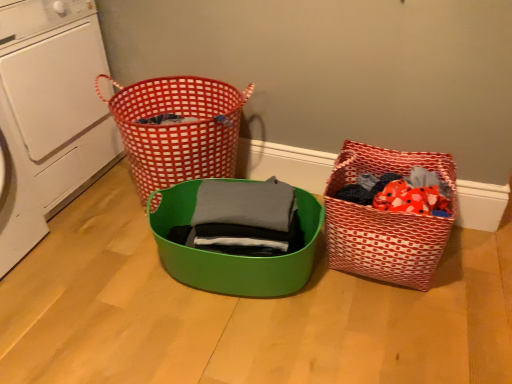
Question: Can you confirm if red checkered basket at upper left is shorter than matte green bowl at center, placed as the first basket when sorted from left to right?

Choices:
 (A) no
 (B) yes

Answer: (A)

Question: From the image's perspective, is red checkered basket at upper left beneath matte green bowl at center, which ranks as the second basket in right-to-left order?

Choices:
 (A) yes
 (B) no

Answer: (B)

Question: Is matte green bowl at center, placed as the first basket when sorted from left to right, at the back of red checkered basket at upper left?

Choices:
 (A) yes
 (B) no

Answer: (B)

Question: Can you confirm if red checkered basket at upper left is positioned to the left of matte green bowl at center, placed as the first basket when sorted from left to right?

Choices:
 (A) yes
 (B) no

Answer: (A)

Question: Is the position of red checkered basket at upper left less distant than that of matte green bowl at center, placed as the first basket when sorted from left to right?

Choices:
 (A) no
 (B) yes

Answer: (A)

Question: Looking at their shapes, would you say red checkered basket at upper left is wider or thinner than red woven fabric basket at lower right, which appears as the first basket when viewed from the right?

Choices:
 (A) thin
 (B) wide

Answer: (B)

Question: Which is correct: red checkered basket at upper left is inside red woven fabric basket at lower right, which appears as the first basket when viewed from the right, or outside of it?

Choices:
 (A) outside
 (B) inside

Answer: (A)

Question: From a real-world perspective, relative to red woven fabric basket at lower right, which is the second basket from left to right, is red checkered basket at upper left vertically above or below?

Choices:
 (A) above
 (B) below

Answer: (A)

Question: Is point (195, 140) positioned closer to the camera than point (353, 160)?

Choices:
 (A) farther
 (B) closer

Answer: (B)

Question: From the image's perspective, is red checkered basket at upper left located above or below white plastic washing machine at left?

Choices:
 (A) below
 (B) above

Answer: (A)

Question: In terms of width, does red checkered basket at upper left look wider or thinner when compared to white plastic washing machine at left?

Choices:
 (A) thin
 (B) wide

Answer: (A)

Question: Considering the positions of point (160, 157) and point (31, 140), is point (160, 157) closer or farther from the camera than point (31, 140)?

Choices:
 (A) closer
 (B) farther

Answer: (A)

Question: Is red checkered basket at upper left bigger or smaller than white plastic washing machine at left?

Choices:
 (A) small
 (B) big

Answer: (A)

Question: From the image's perspective, is white plastic washing machine at left positioned above or below matte green bowl at center, placed as the first basket when sorted from left to right?

Choices:
 (A) below
 (B) above

Answer: (B)

Question: Is white plastic washing machine at left taller or shorter than matte green bowl at center, which ranks as the second basket in right-to-left order?

Choices:
 (A) tall
 (B) short

Answer: (A)